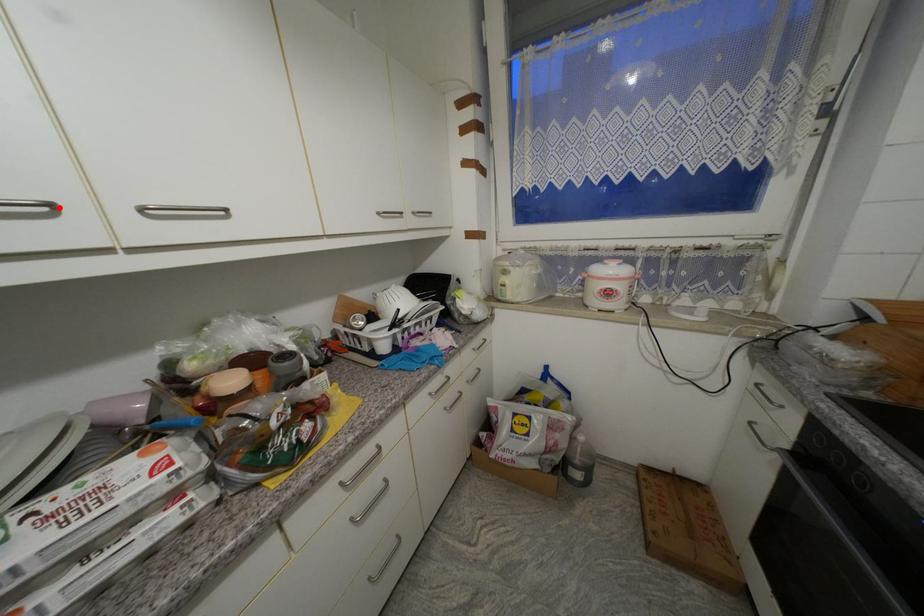
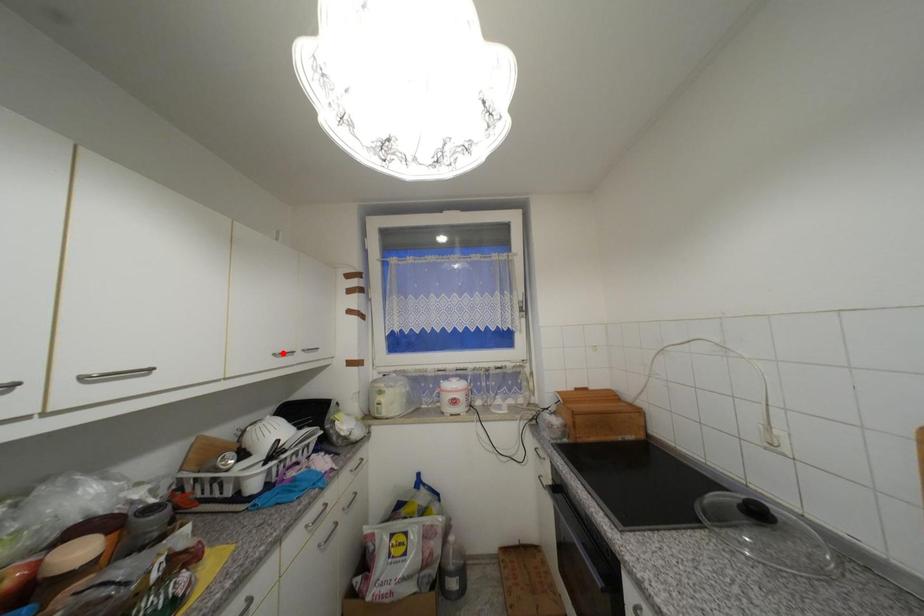
I am providing you with two images of the same scene from different viewpoints. A red point is marked on the first image and another point is marked on the second image. Does the point marked in image1 correspond to the same location as the one in image2?

No